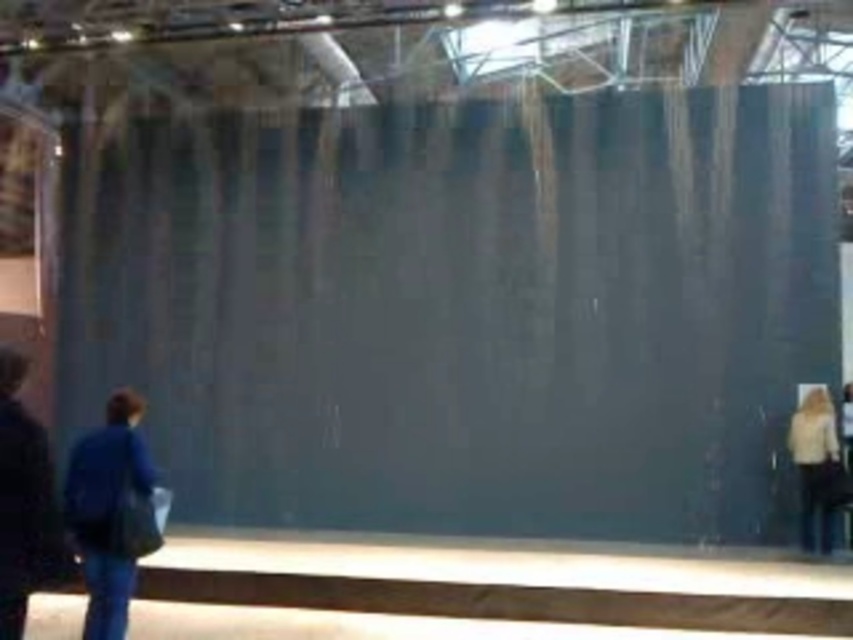
Can you confirm if dark blue jacket at left is positioned to the left of light beige sweater at lower right?

Indeed, dark blue jacket at left is positioned on the left side of light beige sweater at lower right.

What do you see at coordinates (24, 502) in the screenshot?
I see `dark blue jacket at left` at bounding box center [24, 502].

Find the location of `dark blue jacket at left`. dark blue jacket at left is located at coordinates (24, 502).

This screenshot has height=640, width=853. Describe the element at coordinates (106, 508) in the screenshot. I see `blue fabric bag at lower left` at that location.

This screenshot has height=640, width=853. Describe the element at coordinates (106, 508) in the screenshot. I see `blue fabric bag at lower left` at that location.

You are a GUI agent. You are given a task and a screenshot of the screen. Output one action in this format:
    pyautogui.click(x=<x>, y=<y>)
    Task: Click on the blue fabric bag at lower left
    This screenshot has width=853, height=640.
    Given the screenshot: What is the action you would take?
    pyautogui.click(x=106, y=508)

Based on the photo, can you confirm if dark blue jacket at left is taller than blue fabric bag at lower left?

No, dark blue jacket at left is not taller than blue fabric bag at lower left.

Locate an element on the screen. dark blue jacket at left is located at coordinates (24, 502).